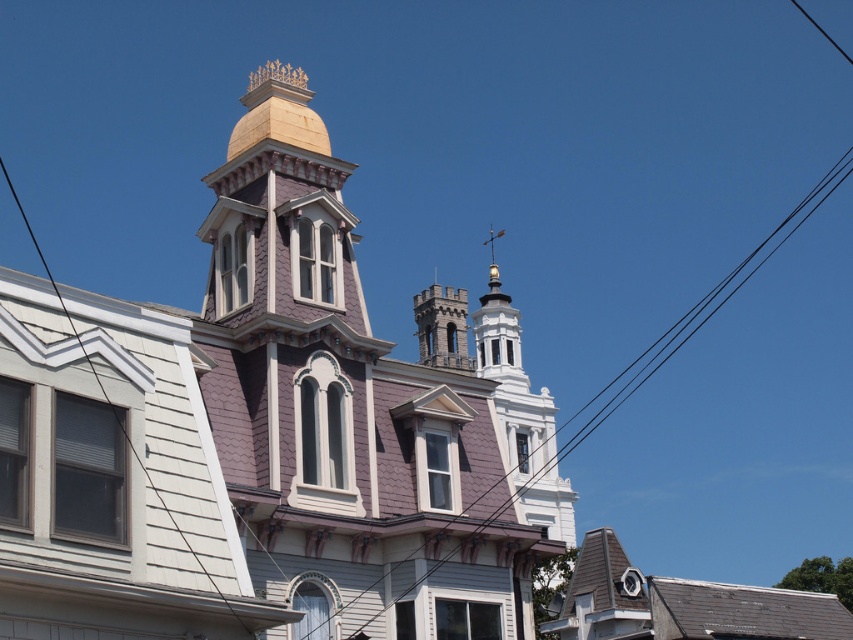
You are standing in front of the Victorian building and want to take a photo of both the purple shingles at center and the gray stone tower at center. Which object will appear larger in your photo?

The purple shingles at center will appear larger in the photo because they are closer to the viewer than the gray stone tower at center.

You are a drone operator tasked with capturing aerial footage of the purple shingles at center and the gray stone tower at center. Your drone can only fly up to 40 meters. Can you capture both structures in a single flight without exceeding the drone limit?

The distance between the purple shingles at center and the gray stone tower at center is 45.61 meters, which exceeds the drone flight limit of 40 meters. Therefore, you cannot capture both structures in a single flight without exceeding the limit.

You are an architect analyzing the building facade. Which of the two elements, the purple shingles at center or the gray stone tower at center, extends higher into the sky?

The purple shingles at center extends higher into the sky than the gray stone tower at center as stated in the description.